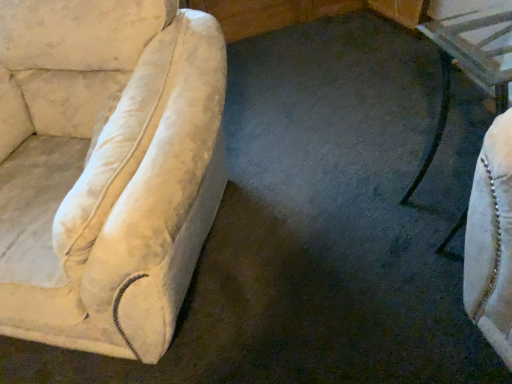
Question: Should I look upward or downward to see black metal table at right?

Choices:
 (A) down
 (B) up

Answer: (B)